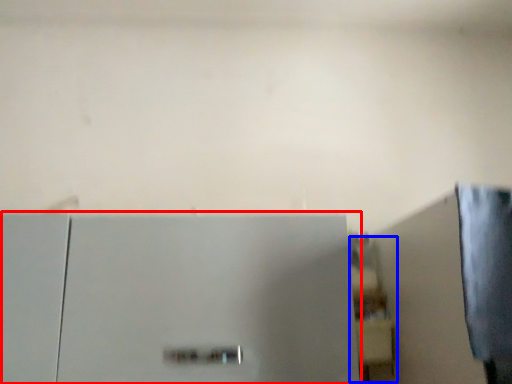
Question: Which object is closer to the camera taking this photo, refrigerator (highlighted by a red box) or shelf (highlighted by a blue box)?

Choices:
 (A) refrigerator
 (B) shelf

Answer: (A)